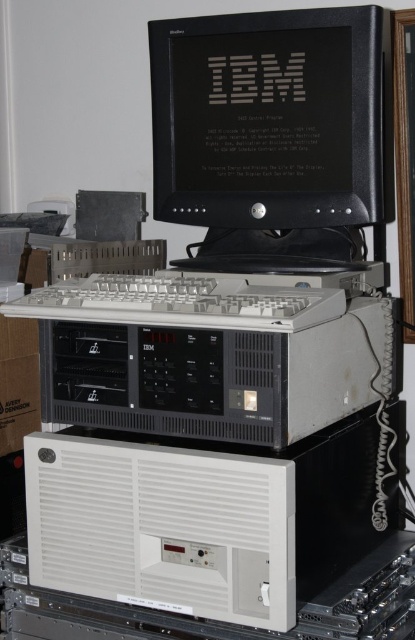
Does white plastic keyboard at center appear on the right side of white cardboard box at lower left?

Indeed, white plastic keyboard at center is positioned on the right side of white cardboard box at lower left.

Does white plastic keyboard at center have a lesser width compared to white cardboard box at lower left?

Incorrect, white plastic keyboard at center's width is not less than white cardboard box at lower left's.

Who is more distant from viewer, (178, 310) or (14, 364)?

Point (14, 364)

Find the location of `white plastic keyboard at center`. white plastic keyboard at center is located at coordinates (182, 301).

Is black glossy monitor at center in front of gray matte keyboard at center?

No, it is behind gray matte keyboard at center.

Is point (292, 205) farther from viewer compared to point (241, 280)?

Yes, point (292, 205) is farther from viewer.

Locate an element on the screen. black glossy monitor at center is located at coordinates (271, 132).

Which is more to the left, black glossy monitor at center or white plastic keyboard at center?

white plastic keyboard at center

Is black glossy monitor at center thinner than white plastic keyboard at center?

Indeed, black glossy monitor at center has a lesser width compared to white plastic keyboard at center.

Does point (224, 33) lie behind point (253, 308)?

That is True.

Find the location of a particular element. black glossy monitor at center is located at coordinates (271, 132).